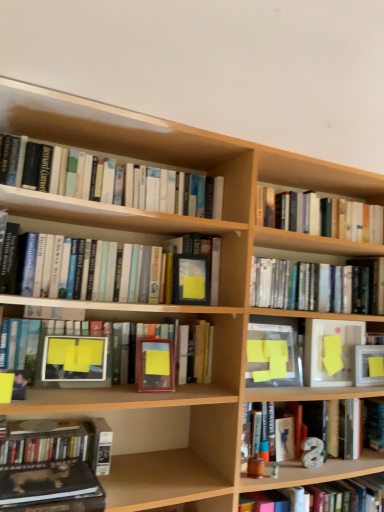
Question: Looking at the image, does yellow matte paper at center, positioned as the 2th paperback book in right-to-left order, seem bigger or smaller compared to matte black book at center, the third paperback book viewed from the right?

Choices:
 (A) small
 (B) big

Answer: (B)

Question: From the image's perspective, is yellow matte paper at center, positioned as the 2th paperback book in right-to-left order, above or below matte black book at center, the third paperback book viewed from the right?

Choices:
 (A) below
 (B) above

Answer: (A)

Question: Which object is the farthest from the brown leather book at lower left, which ranks as the second book in bottom-to-top order?

Choices:
 (A) wooden picture frame at center, arranged as the second picture frame when viewed from the left
 (B) yellow matte paper at center, the second paperback book when ordered from left to right
 (C) matte black book at center, which ranks as the 1th paperback book in left-to-right order
 (D) matte yellow picture frame at center-left, acting as the 2th picture frame starting from the right
 (E) hardcover book at lower left, marked as the third book in a bottom-to-top arrangement

Answer: (B)

Question: Which object is positioned closest to the hardcover book at center, which appears as the 2th book when viewed from the top?

Choices:
 (A) wooden picture frame at center, the first picture frame from the right
 (B) matte black book at center, the third paperback book viewed from the right
 (C) brown leather book at lower left, the sixth book positioned from the top
 (D) hardcover books at upper right, which ranks as the 7th book in bottom-to-top order
 (E) hardcover book at lower left, the fifth book viewed from the top

Answer: (B)